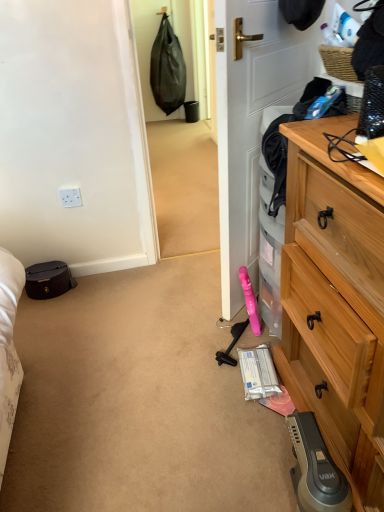
The height and width of the screenshot is (512, 384). Identify the location of woven brown picnic basket at upper right. (338, 62).

Measure the distance between matte black suitcase at left and camera.

The depth of matte black suitcase at left is 1.84 meters.

This screenshot has width=384, height=512. What do you see at coordinates (70, 197) in the screenshot?
I see `white plastic power outlet at upper left` at bounding box center [70, 197].

You are a GUI agent. You are given a task and a screenshot of the screen. Output one action in this format:
    pyautogui.click(x=<x>, y=<y>)
    Task: Click on the woven brown picnic basket at upper right
    The image size is (384, 512).
    Given the screenshot: What is the action you would take?
    pyautogui.click(x=338, y=62)

Choose the correct answer: Is white plastic power outlet at upper left inside matte black suitcase at left or outside it?

white plastic power outlet at upper left is spatially situated outside matte black suitcase at left.

Which object is further away from the camera taking this photo, white plastic power outlet at upper left or matte black suitcase at left?

matte black suitcase at left.

Which object is wider, white plastic power outlet at upper left or matte black suitcase at left?

matte black suitcase at left.

From the image's perspective, which one is positioned higher, white plastic power outlet at upper left or matte black suitcase at left?

white plastic power outlet at upper left, from the image's perspective.

From a real-world perspective, is woven brown picnic basket at upper right positioned over white plastic power outlet at upper left based on gravity?

Correct, in the physical world, woven brown picnic basket at upper right is higher than white plastic power outlet at upper left.

Is woven brown picnic basket at upper right oriented away from white plastic power outlet at upper left?

No.

Is white plastic power outlet at upper left located within woven brown picnic basket at upper right?

No, white plastic power outlet at upper left is not a part of woven brown picnic basket at upper right.

In the scene shown: Considering the sizes of objects woven brown picnic basket at upper right and white plastic power outlet at upper left in the image provided, who is bigger, woven brown picnic basket at upper right or white plastic power outlet at upper left?

Bigger between the two is woven brown picnic basket at upper right.

Is wooden chest of drawers at right inside the boundaries of woven brown picnic basket at upper right, or outside?

The correct answer is: outside.

From the picture: Are wooden chest of drawers at right and woven brown picnic basket at upper right making contact?

No, wooden chest of drawers at right is not next to woven brown picnic basket at upper right.

From a real-world perspective, is wooden chest of drawers at right on woven brown picnic basket at upper right?

Actually, wooden chest of drawers at right is physically below woven brown picnic basket at upper right in the real world.

Would you say matte black suitcase at left is inside or outside wooden chest of drawers at right?

matte black suitcase at left is not inside wooden chest of drawers at right, it's outside.

Is matte black suitcase at left positioned with its back to wooden chest of drawers at right?

No, matte black suitcase at left is not facing away from wooden chest of drawers at right.

Is point (30, 280) positioned in front of point (337, 291)?

That is False.

Is matte black suitcase at left wider or thinner than wooden chest of drawers at right?

Considering their sizes, matte black suitcase at left looks slimmer than wooden chest of drawers at right.

Which object is positioned more to the right, woven brown picnic basket at upper right or matte black suitcase at left?

From the viewer's perspective, woven brown picnic basket at upper right appears more on the right side.

Choose the correct answer: Is woven brown picnic basket at upper right inside matte black suitcase at left or outside it?

woven brown picnic basket at upper right is spatially situated outside matte black suitcase at left.

What are the coordinates of `luggage and bags behind the woven brown picnic basket at upper right` in the screenshot? It's located at (48, 280).

From a real-world perspective, between woven brown picnic basket at upper right and matte black suitcase at left, who is vertically lower?

matte black suitcase at left.

From their relative heights in the image, would you say white plastic power outlet at upper left is taller or shorter than woven brown picnic basket at upper right?

Clearly, white plastic power outlet at upper left is taller compared to woven brown picnic basket at upper right.

From the image's perspective, which is above, white plastic power outlet at upper left or woven brown picnic basket at upper right?

woven brown picnic basket at upper right is shown above in the image.

Is the position of white plastic power outlet at upper left more distant than that of woven brown picnic basket at upper right?

Yes, white plastic power outlet at upper left is further from the camera.

Which is correct: white plastic power outlet at upper left is inside woven brown picnic basket at upper right, or outside of it?

white plastic power outlet at upper left lies outside woven brown picnic basket at upper right.

In order to click on power outlet located behind the wooden chest of drawers at right in this screenshot , I will do click(70, 197).

From the image's perspective, who appears lower, white plastic power outlet at upper left or wooden chest of drawers at right?

wooden chest of drawers at right.

How many degrees apart are the facing directions of white plastic power outlet at upper left and wooden chest of drawers at right?

The angular difference between white plastic power outlet at upper left and wooden chest of drawers at right is 90.9 degrees.

Is white plastic power outlet at upper left inside the boundaries of wooden chest of drawers at right, or outside?

white plastic power outlet at upper left is not enclosed by wooden chest of drawers at right.

Where is `luggage and bags behind the white plastic power outlet at upper left`? This screenshot has height=512, width=384. luggage and bags behind the white plastic power outlet at upper left is located at coordinates (48, 280).

The height and width of the screenshot is (512, 384). What are the coordinates of `power outlet on the left of the woven brown picnic basket at upper right` in the screenshot? It's located at (70, 197).

When comparing their distances from wooden chest of drawers at right, does white matte door at center or woven brown picnic basket at upper right seem further?

The object further to wooden chest of drawers at right is woven brown picnic basket at upper right.

Looking at the image, which one is located further to woven brown picnic basket at upper right, matte black suitcase at left or white matte door at center?

Among the two, matte black suitcase at left is located further to woven brown picnic basket at upper right.

Which object lies further to the anchor point white matte door at center, wooden chest of drawers at right or woven brown picnic basket at upper right?

The object further to white matte door at center is wooden chest of drawers at right.

Which object lies further to the anchor point woven brown picnic basket at upper right, wooden chest of drawers at right or matte black suitcase at left?

matte black suitcase at left is further to woven brown picnic basket at upper right.

Estimate the real-world distances between objects in this image. Which object is further from matte black suitcase at left, wooden chest of drawers at right or white plastic power outlet at upper left?

Among the two, wooden chest of drawers at right is located further to matte black suitcase at left.

Based on their spatial positions, is white plastic power outlet at upper left or white matte door at center closer to woven brown picnic basket at upper right?

white matte door at center lies closer to woven brown picnic basket at upper right than the other object.

Based on their spatial positions, is matte black suitcase at left or woven brown picnic basket at upper right closer to wooden chest of drawers at right?

woven brown picnic basket at upper right is positioned closer to the anchor wooden chest of drawers at right.

Estimate the real-world distances between objects in this image. Which object is closer to wooden chest of drawers at right, woven brown picnic basket at upper right or matte black suitcase at left?

woven brown picnic basket at upper right is positioned closer to the anchor wooden chest of drawers at right.

Locate an element on the screen. The image size is (384, 512). door between white plastic power outlet at upper left and woven brown picnic basket at upper right from left to right is located at coordinates (251, 121).

This screenshot has width=384, height=512. I want to click on power outlet between wooden chest of drawers at right and matte black suitcase at left along the z-axis, so pos(70,197).

Where is `door between wooden chest of drawers at right and matte black suitcase at left along the z-axis`? This screenshot has height=512, width=384. door between wooden chest of drawers at right and matte black suitcase at left along the z-axis is located at coordinates (251, 121).

At what (x,y) coordinates should I click in order to perform the action: click on door between matte black suitcase at left and woven brown picnic basket at upper right in the horizontal direction. Please return your answer as a coordinate pair (x, y). This screenshot has height=512, width=384. Looking at the image, I should click on (251, 121).